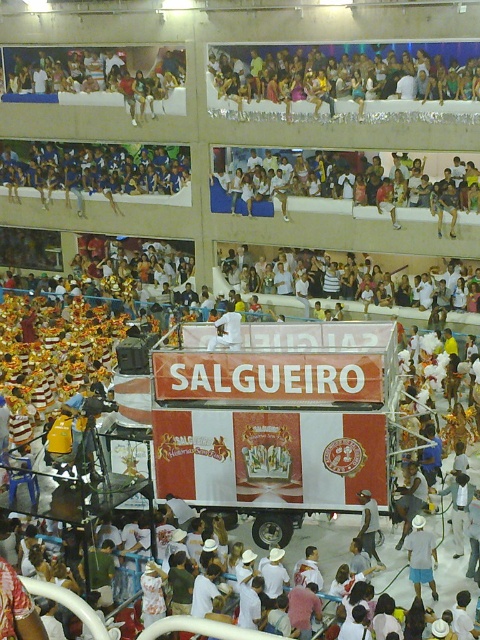
Question: Which object is closer to the camera taking this photo?

Choices:
 (A) white plastic bag at center
 (B) white cotton shorts at center

Answer: (B)

Question: Does white cotton shorts at center have a greater width compared to white plastic bag at center?

Choices:
 (A) no
 (B) yes

Answer: (A)

Question: Is white cotton shorts at center positioned in front of white plastic bag at center?

Choices:
 (A) yes
 (B) no

Answer: (A)

Question: Which object is farther from the camera taking this photo?

Choices:
 (A) white cotton shorts at center
 (B) white plastic bag at center

Answer: (B)

Question: Can you confirm if white cotton shorts at center is positioned to the right of white plastic bag at center?

Choices:
 (A) yes
 (B) no

Answer: (A)

Question: Which of the following is the closest to the observer?

Choices:
 (A) white cotton shorts at center
 (B) white plastic bag at center

Answer: (A)